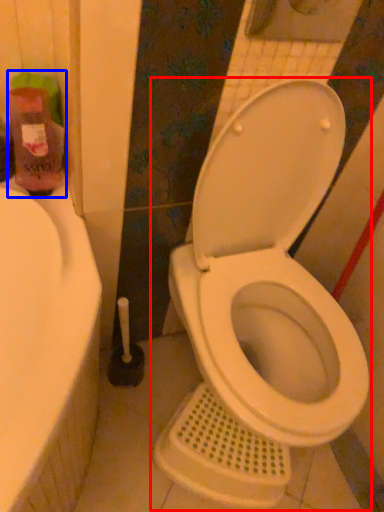
Question: Which point is closer to the camera, toilet (highlighted by a red box) or cleaning product (highlighted by a blue box)?

Choices:
 (A) toilet
 (B) cleaning product

Answer: (A)